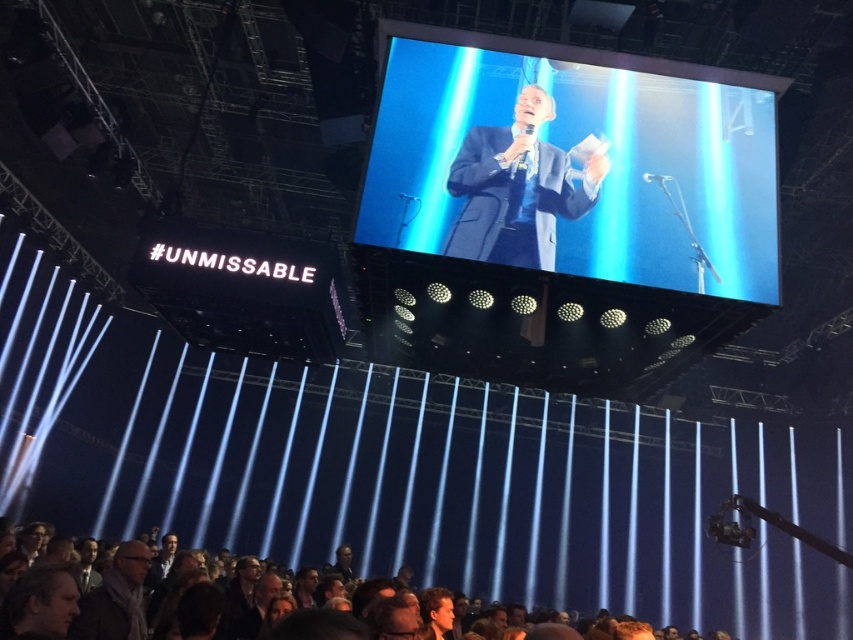
You are an event organizer who needs to place a 3.5 meter long banner between the dark brown leather jacket at lower center and the dark blue suit at center. Is there enough space for the banner?

The distance between the dark brown leather jacket at lower center and the dark blue suit at center is 3.32 meters, which is slightly shorter than the 3.5 meter banner. Therefore, there isn not enough space to place the banner between them.

You are a stagehand who needs to adjust the distance between the shiny blue screen at center and the vertical blue light beams behind the speaker. The event organizer requires them to be exactly 5 meters apart. Currently, they are 4.69 meters apart. How much more space in meters do you need to add between them?

The current distance between the shiny blue screen at center and the vertical blue light beams behind the speaker is 4.69 meters. To reach the required 5 meters, you need to add 0.31 meters between them.